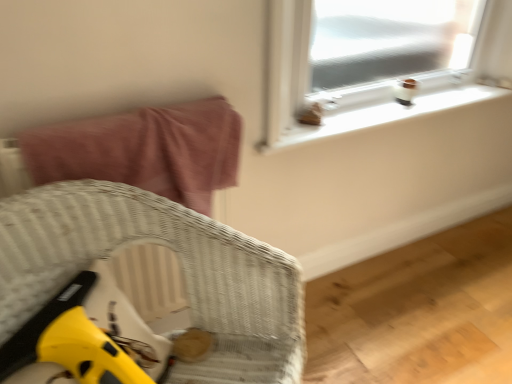
Question: Is point (301, 324) closer or farther from the camera than point (136, 147)?

Choices:
 (A) farther
 (B) closer

Answer: (B)

Question: In the image, is woven wicker chair at lower left on the left side or the right side of pink fabric bed at upper left?

Choices:
 (A) right
 (B) left

Answer: (A)

Question: Which is nearer to the pink fabric bed at upper left?

Choices:
 (A) white plastic window sill at upper right
 (B) woven wicker chair at lower left

Answer: (B)

Question: Which object is the farthest from the woven wicker chair at lower left?

Choices:
 (A) white plastic window sill at upper right
 (B) pink fabric bed at upper left

Answer: (A)